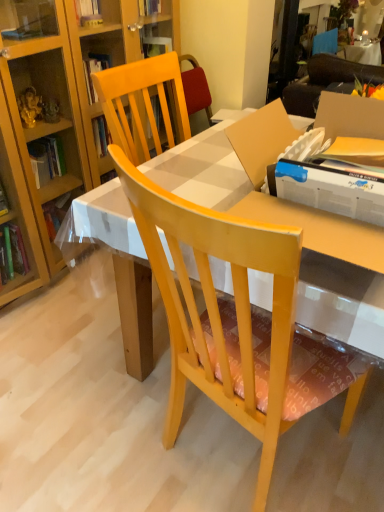
Question: Is light wood chair at center with brown fabric couch at upper right?

Choices:
 (A) yes
 (B) no

Answer: (B)

Question: Is brown fabric couch at upper right at the back of light wood chair at center?

Choices:
 (A) no
 (B) yes

Answer: (A)

Question: Is light wood chair at center at the right side of brown fabric couch at upper right?

Choices:
 (A) no
 (B) yes

Answer: (A)

Question: From a real-world perspective, is light wood chair at center located beneath brown fabric couch at upper right?

Choices:
 (A) no
 (B) yes

Answer: (B)

Question: Would you say light wood chair at center is outside brown fabric couch at upper right?

Choices:
 (A) no
 (B) yes

Answer: (B)

Question: Considering the relative sizes of light wood chair at center and brown fabric couch at upper right in the image provided, is light wood chair at center smaller than brown fabric couch at upper right?

Choices:
 (A) yes
 (B) no

Answer: (B)

Question: Is green leafy plant at upper right further to camera compared to light wood chair at center?

Choices:
 (A) yes
 (B) no

Answer: (A)

Question: Is green leafy plant at upper right closer to camera compared to light wood chair at center?

Choices:
 (A) yes
 (B) no

Answer: (B)

Question: Considering the relative sizes of green leafy plant at upper right and light wood chair at center in the image provided, is green leafy plant at upper right shorter than light wood chair at center?

Choices:
 (A) no
 (B) yes

Answer: (B)

Question: From a real-world perspective, is green leafy plant at upper right positioned under light wood chair at center based on gravity?

Choices:
 (A) no
 (B) yes

Answer: (A)

Question: Is green leafy plant at upper right at the right side of light wood chair at center?

Choices:
 (A) yes
 (B) no

Answer: (A)

Question: Does green leafy plant at upper right have a lesser width compared to light wood chair at center?

Choices:
 (A) no
 (B) yes

Answer: (B)

Question: Does brown fabric couch at upper right have a smaller size compared to green leafy plant at upper right?

Choices:
 (A) yes
 (B) no

Answer: (A)